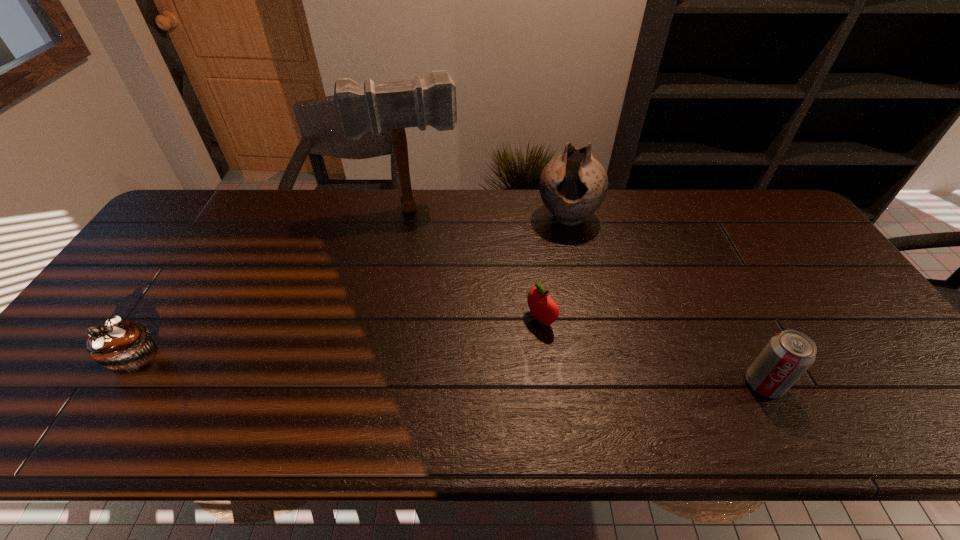
Locate an element on the screen. Image resolution: width=960 pixels, height=540 pixels. cupcake is located at coordinates (124, 347).

At what (x,y) coordinates should I click in order to perform the action: click on the rightmost object. Please return your answer as a coordinate pair (x, y). Looking at the image, I should click on (787, 356).

This screenshot has width=960, height=540. Find the location of `soda can`. soda can is located at coordinates (787, 356).

Identify the location of the third nearest object. Image resolution: width=960 pixels, height=540 pixels. (543, 307).

Where is `pottery`? Image resolution: width=960 pixels, height=540 pixels. pottery is located at coordinates (572, 186).

Locate an element on the screen. the fourth object from right to left is located at coordinates (396, 105).

This screenshot has width=960, height=540. Find the location of `the tallest object`. the tallest object is located at coordinates (396, 105).

The width and height of the screenshot is (960, 540). Find the location of `free location located on the left of the cupcake`. free location located on the left of the cupcake is located at coordinates click(x=60, y=358).

Image resolution: width=960 pixels, height=540 pixels. What are the coordinates of `free space located 0.060m on the left of the soda can` in the screenshot? It's located at (719, 384).

You are a GUI agent. You are given a task and a screenshot of the screen. Output one action in this format:
    pyautogui.click(x=<x>, y=<y>)
    Task: Click on the vacant space located 0.270m on the front-facing side of the third farthest object
    This screenshot has height=540, width=960.
    Given the screenshot: What is the action you would take?
    pyautogui.click(x=439, y=382)